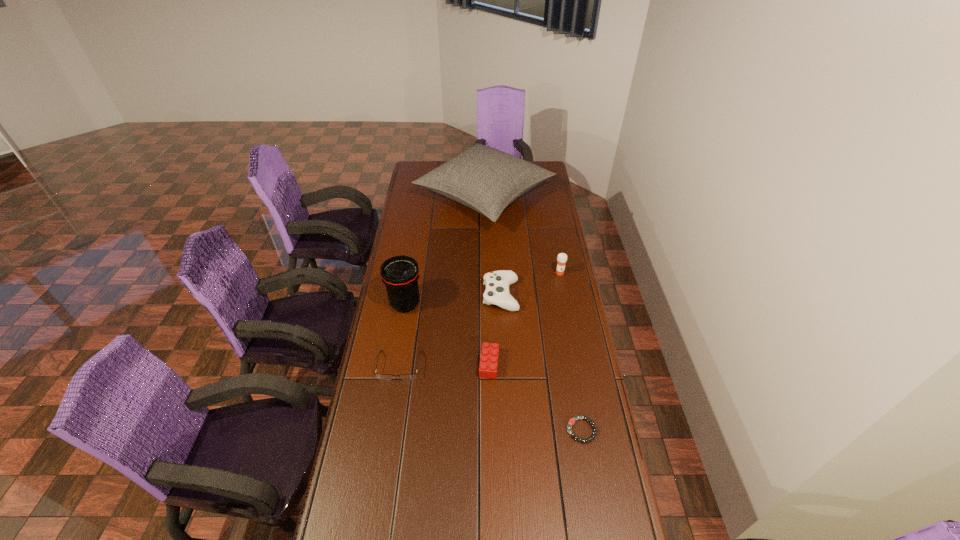
Find the location of a particular element. This screenshot has width=960, height=540. vacant space situated on the front of the telephoto lens is located at coordinates (396, 365).

The height and width of the screenshot is (540, 960). I want to click on vacant space positioned 0.370m on the label side of the medicine, so click(574, 347).

You are a GUI agent. You are given a task and a screenshot of the screen. Output one action in this format:
    pyautogui.click(x=<x>, y=<y>)
    Task: Click on the free spot located 0.370m on the back of the fourth shortest object
    The image size is (960, 540).
    Given the screenshot: What is the action you would take?
    pyautogui.click(x=497, y=225)

Where is `vacant region located on the front of the third shortest object`? This screenshot has width=960, height=540. vacant region located on the front of the third shortest object is located at coordinates (490, 397).

The image size is (960, 540). I want to click on vacant region located 0.330m on the front-facing side of the spectacles, so tap(381, 481).

The width and height of the screenshot is (960, 540). I want to click on free point located 0.120m on the front of the shortest object, so click(x=591, y=485).

Find the location of `object that is at the far edge`. object that is at the far edge is located at coordinates (487, 180).

Identify the location of cushion present at the left edge. This screenshot has width=960, height=540. (487, 180).

Identify the location of telephoto lens present at the left edge. The image size is (960, 540). (400, 274).

What are the coordinates of `spectacles that is at the left edge` in the screenshot? It's located at (380, 376).